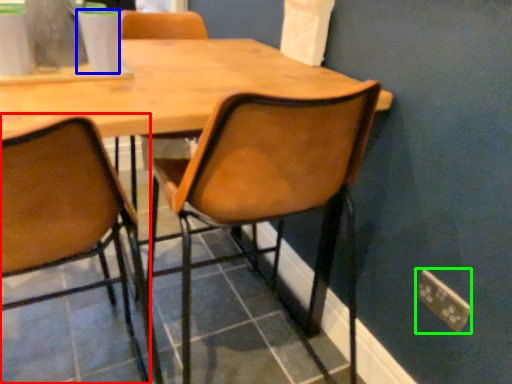
Question: Which is nearer to the chair (highlighted by a red box)? coffee cup (highlighted by a blue box) or power plugs and sockets (highlighted by a green box).

Choices:
 (A) coffee cup
 (B) power plugs and sockets

Answer: (A)